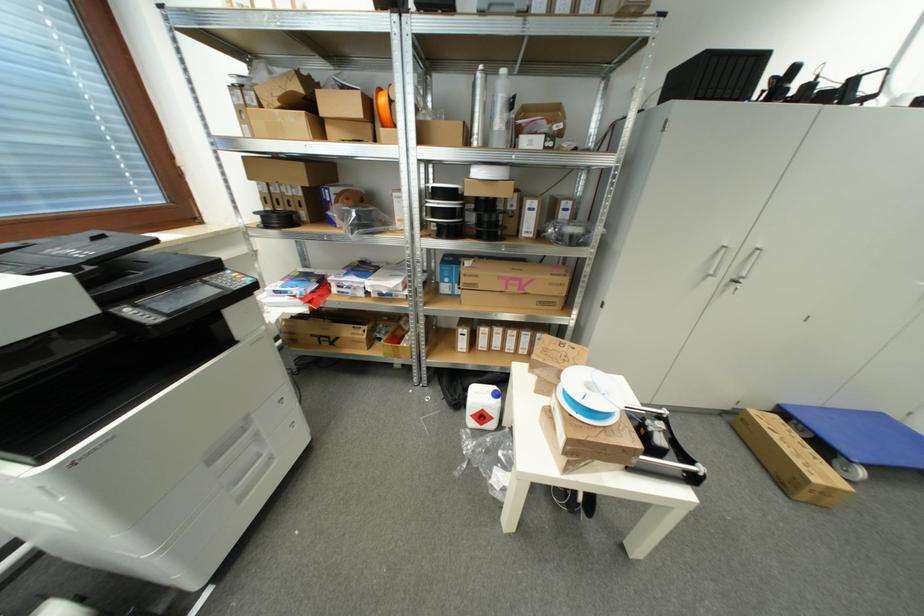
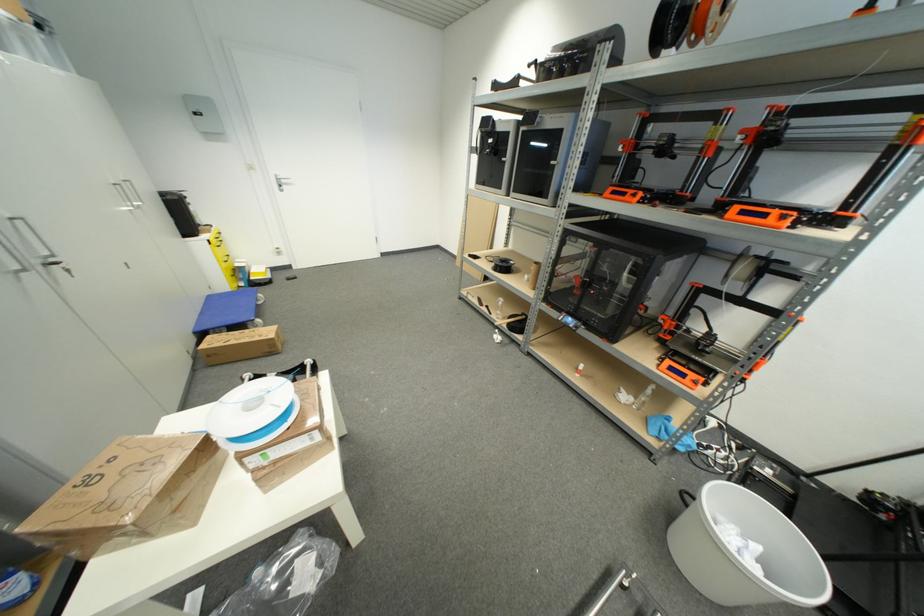
Where in the second image is the point corresponding to point 737,280 from the first image?

(43, 264)